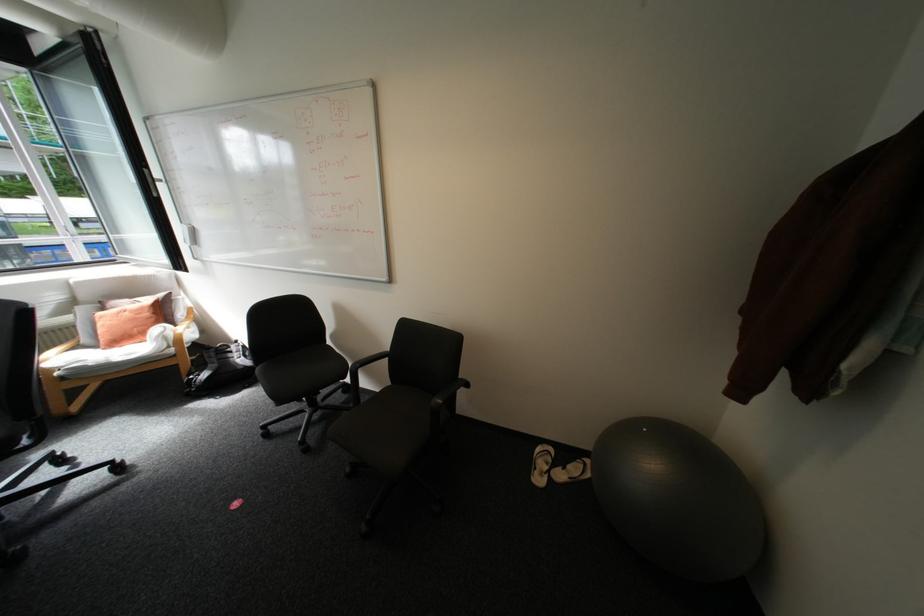
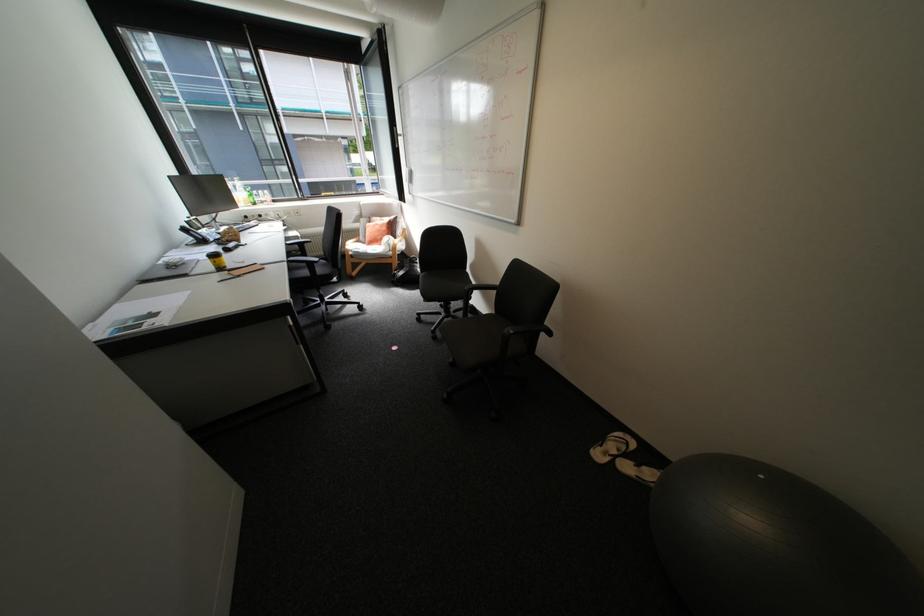
The point at (654, 430) is marked in the first image. Where is the corresponding point in the second image?

(772, 477)